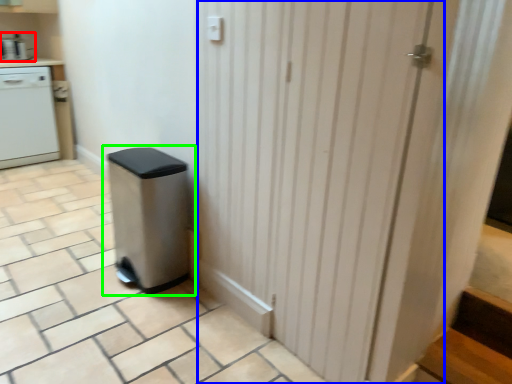
Question: Which object is positioned closest to kitchen appliance (highlighted by a red box)? Select from screen door (highlighted by a blue box) and waste container (highlighted by a green box).

Choices:
 (A) screen door
 (B) waste container

Answer: (B)